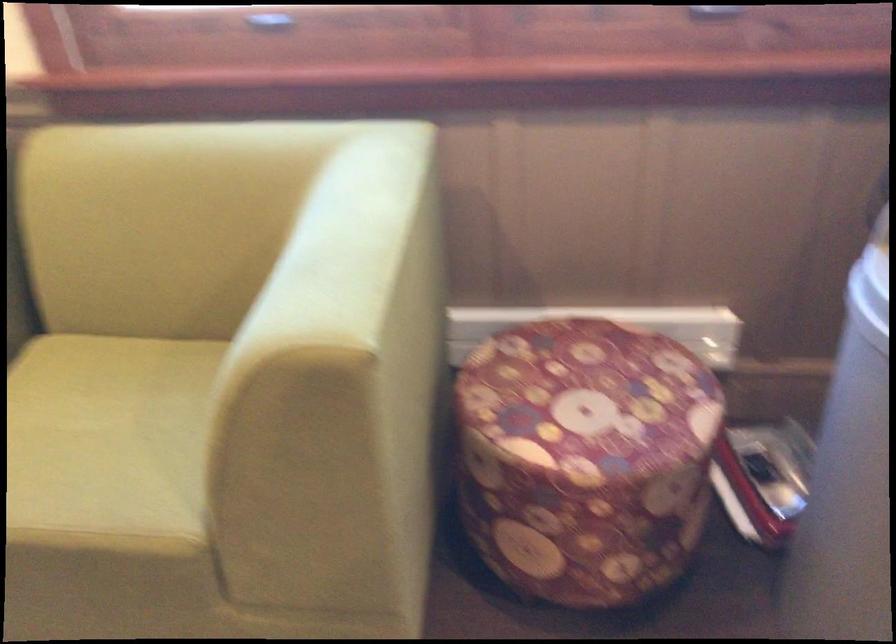
Image resolution: width=896 pixels, height=644 pixels. Describe the element at coordinates (358, 223) in the screenshot. I see `a yellow chair armrest` at that location.